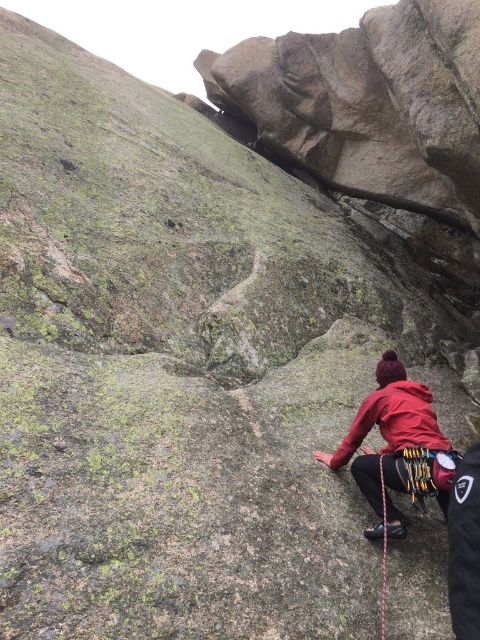
Question: Which point is farther to the camera?

Choices:
 (A) red matte jacket at lower right
 (B) black nylon rope at lower right

Answer: (A)

Question: Which point is farther to the camera?

Choices:
 (A) black nylon rope at lower right
 (B) red fleece jacket at lower right

Answer: (B)

Question: Is red fleece jacket at lower right to the right of red matte jacket at lower right from the viewer's perspective?

Choices:
 (A) no
 (B) yes

Answer: (B)

Question: Does red fleece jacket at lower right have a larger size compared to black nylon rope at lower right?

Choices:
 (A) yes
 (B) no

Answer: (A)

Question: Is red fleece jacket at lower right smaller than red matte jacket at lower right?

Choices:
 (A) yes
 (B) no

Answer: (B)

Question: Which point is farther to the camera?

Choices:
 (A) (381, 465)
 (B) (421, 433)

Answer: (B)